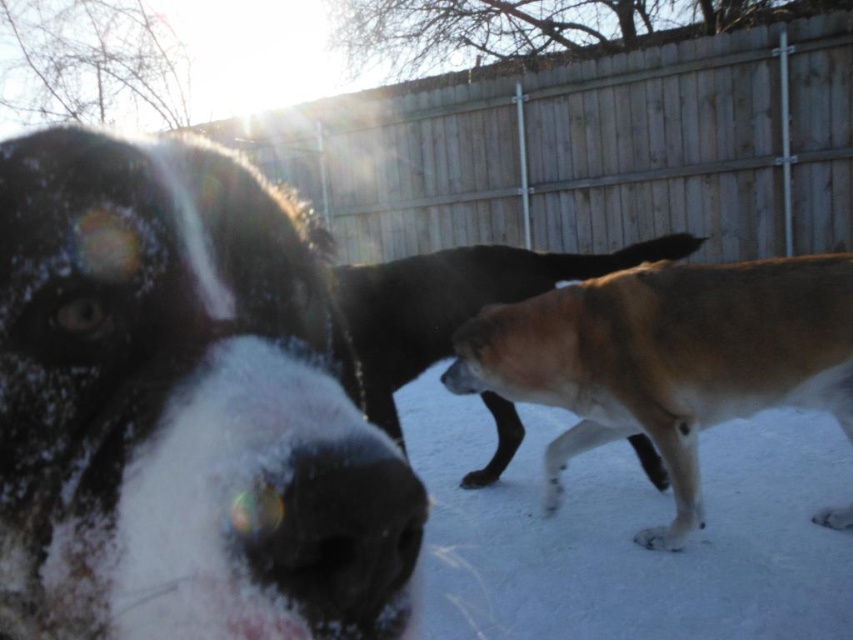
Question: Estimate the real-world distances between objects in this image. Which object is farther from the wooden fence at center?

Choices:
 (A) brown fur dog at center
 (B) white fur dog at center
 (C) brown furry dog at center

Answer: (B)

Question: Can you confirm if white fur dog at center is thinner than black matte nose at center?

Choices:
 (A) no
 (B) yes

Answer: (A)

Question: Which point is farther from the camera taking this photo?

Choices:
 (A) pyautogui.click(x=691, y=45)
 (B) pyautogui.click(x=193, y=154)
 (C) pyautogui.click(x=692, y=364)
 (D) pyautogui.click(x=306, y=525)

Answer: (A)

Question: Where is wooden fence at center located in relation to black matte nose at center in the image?

Choices:
 (A) right
 (B) left

Answer: (A)

Question: Which point is closer to the camera?

Choices:
 (A) white fur dog at center
 (B) wooden fence at center
 (C) brown furry dog at center

Answer: (A)

Question: Is white fur dog at center thinner than brown furry dog at center?

Choices:
 (A) no
 (B) yes

Answer: (B)